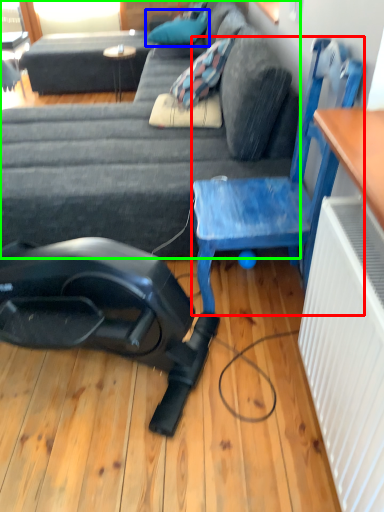
Question: Based on their relative distances, which object is nearer to chair (highlighted by a red box)? Choose from pillow (highlighted by a blue box) and studio couch (highlighted by a green box).

Choices:
 (A) pillow
 (B) studio couch

Answer: (B)